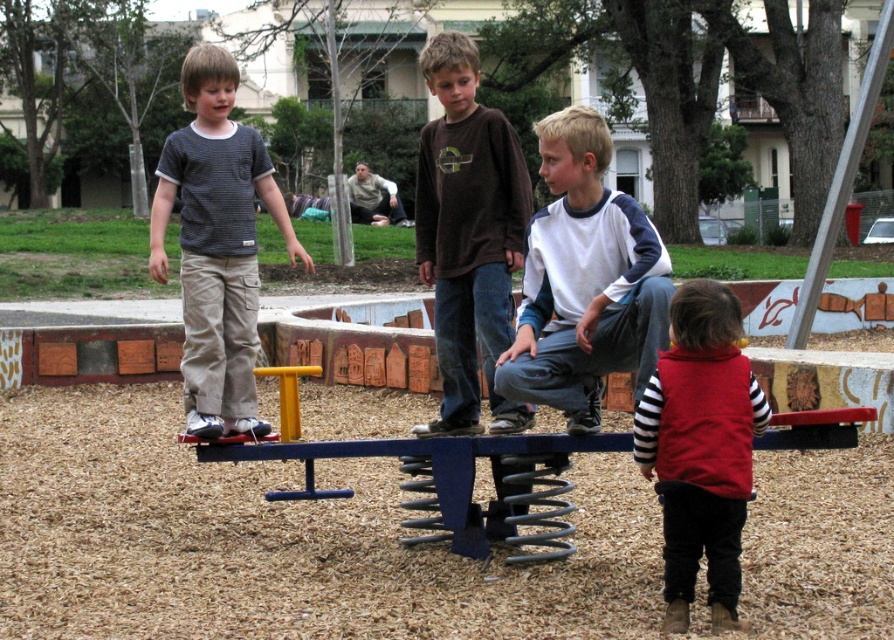
Does brown cotton shirt at center appear over red fleece vest at lower right?

Correct, brown cotton shirt at center is located above red fleece vest at lower right.

Which is above, brown cotton shirt at center or red fleece vest at lower right?

brown cotton shirt at center

I want to click on brown cotton shirt at center, so click(468, 236).

Consider the image. Who is more forward, (235, 150) or (679, 368)?

Point (679, 368)

In the scene shown: Between striped cotton shirt at center and red fleece vest at lower right, which one appears on the right side from the viewer's perspective?

From the viewer's perspective, red fleece vest at lower right appears more on the right side.

Which is in front, point (250, 275) or point (661, 442)?

Point (661, 442) is more forward.

Find the location of a particular element. striped cotton shirt at center is located at coordinates (216, 244).

Can you confirm if brown cotton shirt at center is positioned to the right of striped cotton shirt at center?

Correct, you'll find brown cotton shirt at center to the right of striped cotton shirt at center.

Is brown cotton shirt at center bigger than striped cotton shirt at center?

Actually, brown cotton shirt at center might be smaller than striped cotton shirt at center.

Is point (500, 218) positioned before point (197, 259)?

Yes, it is.

Identify the location of brown cotton shirt at center. (468, 236).